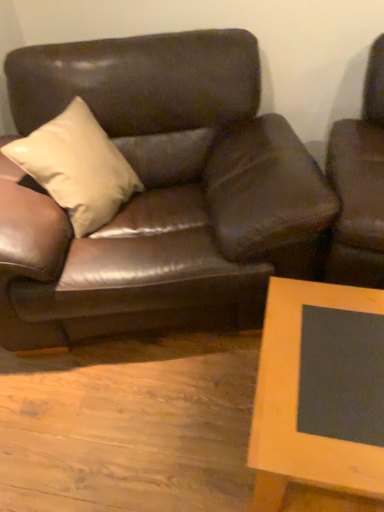
Question: Is wooden frame at lower right behind matte brown leather couch at center?

Choices:
 (A) no
 (B) yes

Answer: (A)

Question: Is matte brown leather couch at center surrounded by wooden frame at lower right?

Choices:
 (A) yes
 (B) no

Answer: (B)

Question: Is wooden frame at lower right shorter than matte brown leather couch at center?

Choices:
 (A) yes
 (B) no

Answer: (A)

Question: From a real-world perspective, is wooden frame at lower right beneath matte brown leather couch at center?

Choices:
 (A) yes
 (B) no

Answer: (A)

Question: From a real-world perspective, is wooden frame at lower right located higher than matte brown leather couch at center?

Choices:
 (A) yes
 (B) no

Answer: (B)

Question: Would you say wooden frame at lower right is a long distance from matte brown leather couch at center?

Choices:
 (A) no
 (B) yes

Answer: (A)

Question: Considering the relative sizes of matte brown leather couch at center and wooden frame at lower right in the image provided, is matte brown leather couch at center smaller than wooden frame at lower right?

Choices:
 (A) yes
 (B) no

Answer: (B)

Question: Is matte brown leather couch at center behind wooden frame at lower right?

Choices:
 (A) yes
 (B) no

Answer: (A)

Question: From a real-world perspective, does matte brown leather couch at center sit lower than wooden frame at lower right?

Choices:
 (A) yes
 (B) no

Answer: (B)

Question: Is matte brown leather couch at center closer to camera compared to wooden frame at lower right?

Choices:
 (A) no
 (B) yes

Answer: (A)

Question: Can you confirm if matte brown leather couch at center is taller than wooden frame at lower right?

Choices:
 (A) no
 (B) yes

Answer: (B)

Question: From a real-world perspective, is matte brown leather couch at center on wooden frame at lower right?

Choices:
 (A) yes
 (B) no

Answer: (A)

Question: In the image, is matte brown leather couch at center on the left side or the right side of wooden frame at lower right?

Choices:
 (A) right
 (B) left

Answer: (B)